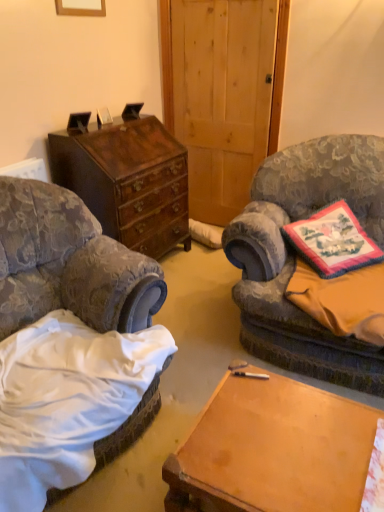
Question: Is wooden desk at center in front of or behind velvet-patterned armchair at left, which appears as the 2th chair when viewed from the right, in the image?

Choices:
 (A) front
 (B) behind

Answer: (B)

Question: Is wooden desk at center inside the boundaries of velvet-patterned armchair at left, which is counted as the 1th chair, starting from the left, or outside?

Choices:
 (A) inside
 (B) outside

Answer: (B)

Question: Which object is the farthest from the velvet-patterned armchair at left, which is counted as the 1th chair, starting from the left?

Choices:
 (A) orange fabric pillow at right, the 2th sheet positioned from the bottom
 (B) wooden desk at center
 (C) wooden picture frame at upper center
 (D) floral fabric sheet at lower right, the 2th sheet when ordered from top to bottom
 (E) embroidered fabric pillow at right

Answer: (C)

Question: Which of these objects is positioned closest to the embroidered fabric pillow at right?

Choices:
 (A) wooden desk at center
 (B) orange fabric pillow at right, the 2th sheet positioned from the bottom
 (C) velvet-patterned armchair at left, which is counted as the 1th chair, starting from the left
 (D) mahogany wood chest of drawers at left
 (E) velvet floral chair at right, the 1th chair in the right-to-left sequence

Answer: (B)